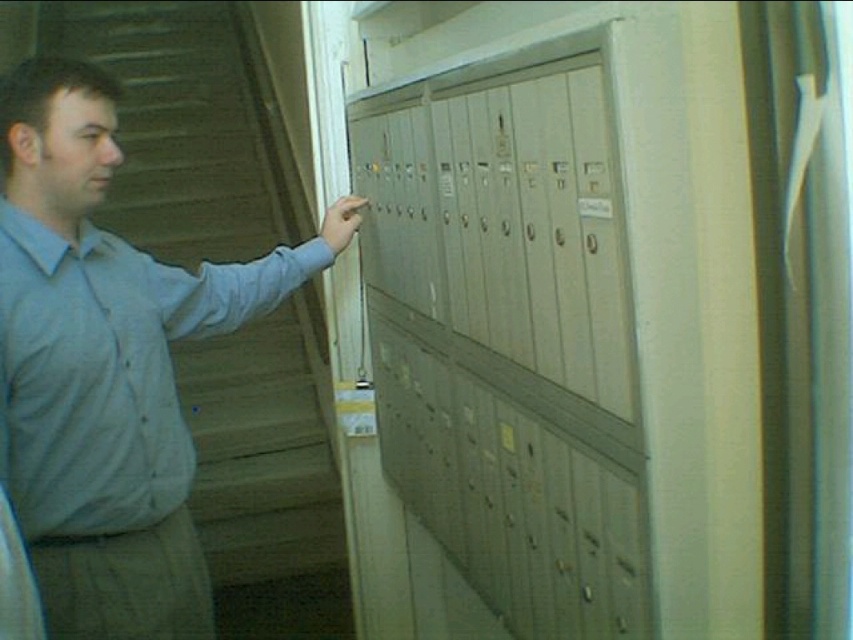
You are a delivery person trying to deliver a package to the metallic gray locker at center. You notice the light blue shirt at left is blocking the path. Considering their sizes, can you fit through the space between them?

The metallic gray locker at center has a lesser width compared to light blue shirt at left. Since the locker is narrower than the shirt, there might not be enough space to pass between them. You should move the light blue shirt at left aside first.

You are a delivery person trying to place a package into the correct locker. The metallic gray locker at center and the light blue shirt at left are in your line of sight. Which object is closer to you?

The metallic gray locker at center is closer to you because it is in front of the light blue shirt at left.